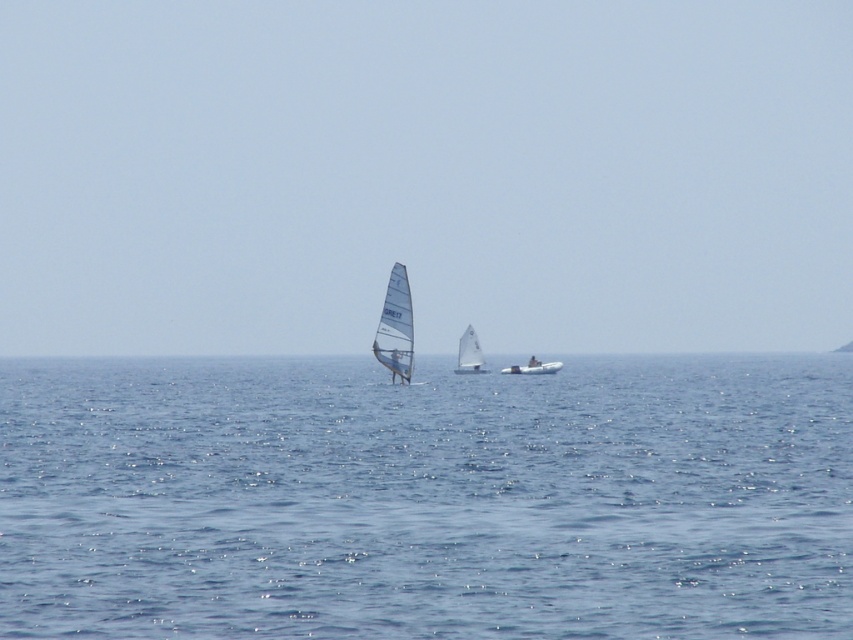
Describe the element at coordinates (426, 499) in the screenshot. This screenshot has height=640, width=853. I see `blue water at center` at that location.

Locate an element on the screen. blue water at center is located at coordinates (426, 499).

Does blue water at center come in front of white matte dinghy at center?

Yes.

Is blue water at center above white matte dinghy at center?

Incorrect, blue water at center is not positioned above white matte dinghy at center.

In order to click on blue water at center in this screenshot , I will do `click(426, 499)`.

Is transparent sailboat at center wider than white matte sailboat at center?

Correct, the width of transparent sailboat at center exceeds that of white matte sailboat at center.

Which of these two, transparent sailboat at center or white matte sailboat at center, stands shorter?

white matte sailboat at center

Between point (311, 84) and point (393, 275), which one is positioned behind?

The point (311, 84) is more distant.

The width and height of the screenshot is (853, 640). I want to click on transparent sailboat at center, so click(x=424, y=176).